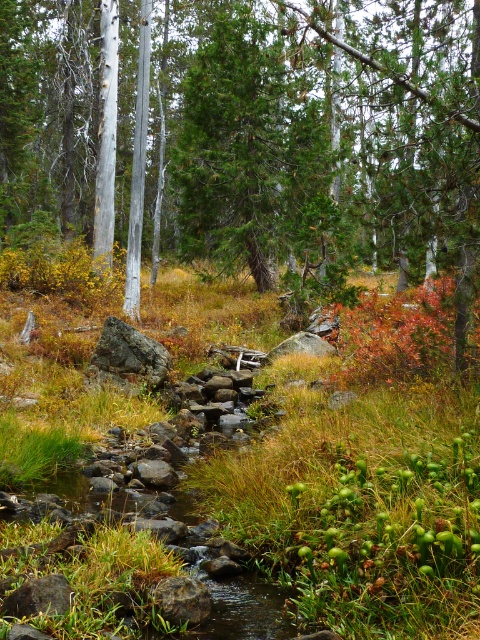
Between point (165, 193) and point (160, 376), which one is positioned in front?

Point (160, 376)

Does green textured tree at center appear over gray rock at center?

Correct, green textured tree at center is located above gray rock at center.

Measure the distance between green textured tree at center and camera.

A distance of 23.48 feet exists between green textured tree at center and camera.

The height and width of the screenshot is (640, 480). What are the coordinates of `green textured tree at center` in the screenshot? It's located at (251, 141).

Which of these two, green grass at center or gray rock at center, stands shorter?

gray rock at center

Does point (279, 371) lie behind point (168, 358)?

Yes, point (279, 371) is behind point (168, 358).

The height and width of the screenshot is (640, 480). I want to click on green grass at center, so click(x=365, y=477).

Does green textured tree at center appear over green grass at center?

Correct, green textured tree at center is located above green grass at center.

Which is behind, point (332, 38) or point (421, 598)?

The point (332, 38) is more distant.

Which is behind, point (69, 150) or point (356, 481)?

The point (69, 150) is behind.

Identify the location of green textured tree at center. The image size is (480, 640). [x=251, y=141].